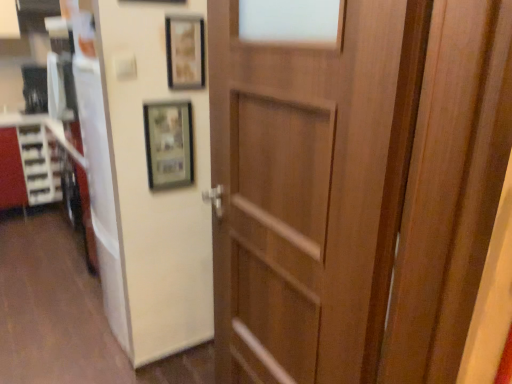
Question: Is matte wooden picture frame at upper center, which is the 2th picture frame from top to bottom, at the left side of wooden door at center?

Choices:
 (A) no
 (B) yes

Answer: (B)

Question: From the image's perspective, would you say matte wooden picture frame at upper center, the 1th picture frame positioned from the bottom, is shown under wooden door at center?

Choices:
 (A) no
 (B) yes

Answer: (A)

Question: Does matte wooden picture frame at upper center, the 1th picture frame positioned from the bottom, have a lesser width compared to wooden door at center?

Choices:
 (A) yes
 (B) no

Answer: (A)

Question: Would you say matte wooden picture frame at upper center, which is the 2th picture frame from top to bottom, contains wooden door at center?

Choices:
 (A) no
 (B) yes

Answer: (A)

Question: Is matte wooden picture frame at upper center, which is the 2th picture frame from top to bottom, wider than wooden door at center?

Choices:
 (A) no
 (B) yes

Answer: (A)

Question: From a real-world perspective, is matte wooden picture frame at upper center, which is the 2th picture frame from top to bottom, located beneath wooden door at center?

Choices:
 (A) no
 (B) yes

Answer: (A)

Question: Can you confirm if matte wooden picture frame at upper center, which is the 2th picture frame from top to bottom, is wider than matte white cabinet at left?

Choices:
 (A) yes
 (B) no

Answer: (B)

Question: Is matte wooden picture frame at upper center, the 1th picture frame positioned from the bottom, aimed at matte white cabinet at left?

Choices:
 (A) no
 (B) yes

Answer: (A)

Question: Are matte wooden picture frame at upper center, which is the 2th picture frame from top to bottom, and matte white cabinet at left beside each other?

Choices:
 (A) yes
 (B) no

Answer: (B)

Question: Considering the relative sizes of matte wooden picture frame at upper center, the 1th picture frame positioned from the bottom, and matte white cabinet at left in the image provided, is matte wooden picture frame at upper center, the 1th picture frame positioned from the bottom, taller than matte white cabinet at left?

Choices:
 (A) no
 (B) yes

Answer: (A)

Question: Is matte wooden picture frame at upper center, which is the 2th picture frame from top to bottom, to the right of matte white cabinet at left from the viewer's perspective?

Choices:
 (A) no
 (B) yes

Answer: (B)

Question: Is the position of matte wooden picture frame at upper center, which is the 2th picture frame from top to bottom, more distant than that of matte white cabinet at left?

Choices:
 (A) yes
 (B) no

Answer: (B)

Question: Does matte white cabinet at left have a greater height compared to matte wooden picture frame at upper center, which is the 2th picture frame from top to bottom?

Choices:
 (A) no
 (B) yes

Answer: (B)